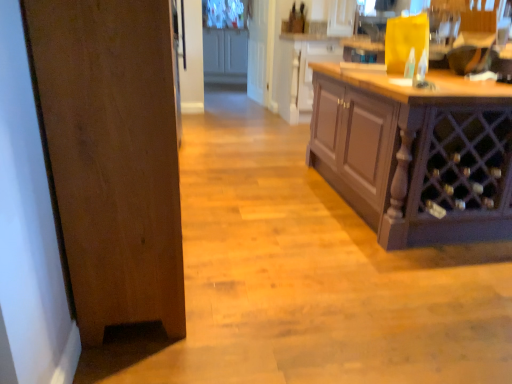
Where is `white glossy door at upper center`? This screenshot has height=384, width=512. white glossy door at upper center is located at coordinates pyautogui.click(x=260, y=50).

Image resolution: width=512 pixels, height=384 pixels. What do you see at coordinates (260, 50) in the screenshot? I see `white glossy door at upper center` at bounding box center [260, 50].

What do you see at coordinates (113, 156) in the screenshot? This screenshot has width=512, height=384. I see `wooden door at left` at bounding box center [113, 156].

Find the location of a particular element. wooden door at left is located at coordinates (113, 156).

The image size is (512, 384). Identify the location of matte gray cabinets at upper center, which is the 1th cabinetry in top-to-bottom order. (225, 56).

What do you see at coordinates (416, 154) in the screenshot? The width and height of the screenshot is (512, 384). I see `brown wood cabinet at right, which is the 3th cabinetry in top-to-bottom order` at bounding box center [416, 154].

Where is `white glossy door at upper center`? This screenshot has width=512, height=384. white glossy door at upper center is located at coordinates point(260,50).

Considering the relative positions of matte gray cabinets at upper center, placed as the 1th cabinetry when sorted from back to front, and matte wood cabinet at center, arranged as the 2th cabinetry when viewed from the left, in the image provided, is matte gray cabinets at upper center, placed as the 1th cabinetry when sorted from back to front, to the left or to the right of matte wood cabinet at center, arranged as the 2th cabinetry when viewed from the left,?

Clearly, matte gray cabinets at upper center, placed as the 1th cabinetry when sorted from back to front, is on the left of matte wood cabinet at center, arranged as the 2th cabinetry when viewed from the left, in the image.

From a real-world perspective, who is located lower, matte gray cabinets at upper center, the 3th cabinetry when ordered from right to left, or matte wood cabinet at center, which appears as the second cabinetry when viewed from the right?

In real-world perspective, matte wood cabinet at center, which appears as the second cabinetry when viewed from the right, is lower.

Which is in front, point (228, 48) or point (297, 62)?

The point (297, 62) is closer to the camera.

How much distance is there between matte gray cabinets at upper center, which is the 1th cabinetry in top-to-bottom order, and matte wood cabinet at center, which appears as the second cabinetry when viewed from the right?

A distance of 1.70 meters exists between matte gray cabinets at upper center, which is the 1th cabinetry in top-to-bottom order, and matte wood cabinet at center, which appears as the second cabinetry when viewed from the right.

How many degrees apart are the facing directions of matte wood cabinet at center, marked as the 2th cabinetry in a bottom-to-top arrangement, and brown wood cabinet at right, which ranks as the first cabinetry in front-to-back order?

The facing directions of matte wood cabinet at center, marked as the 2th cabinetry in a bottom-to-top arrangement, and brown wood cabinet at right, which ranks as the first cabinetry in front-to-back order, are 179 degrees apart.

From the image's perspective, is matte wood cabinet at center, the second cabinetry viewed from the top, beneath brown wood cabinet at right, which ranks as the first cabinetry in bottom-to-top order?

Incorrect, from the image's perspective, matte wood cabinet at center, the second cabinetry viewed from the top, is higher than brown wood cabinet at right, which ranks as the first cabinetry in bottom-to-top order.

Would you say matte wood cabinet at center, marked as the 2th cabinetry in a bottom-to-top arrangement, is inside or outside brown wood cabinet at right, which is the 3th cabinetry in top-to-bottom order?

matte wood cabinet at center, marked as the 2th cabinetry in a bottom-to-top arrangement, is located beyond the bounds of brown wood cabinet at right, which is the 3th cabinetry in top-to-bottom order.

From a real-world perspective, is matte wood cabinet at center, arranged as the 2th cabinetry when viewed from the left, located beneath brown wood cabinet at right, which ranks as the first cabinetry in bottom-to-top order?

Indeed, from a real-world perspective, matte wood cabinet at center, arranged as the 2th cabinetry when viewed from the left, is positioned beneath brown wood cabinet at right, which ranks as the first cabinetry in bottom-to-top order.

Is white glossy door at upper center aimed at brown wood cabinet at right, the third cabinetry in the left-to-right sequence?

No, white glossy door at upper center is not turned towards brown wood cabinet at right, the third cabinetry in the left-to-right sequence.

Does white glossy door at upper center lie behind brown wood cabinet at right, which ranks as the first cabinetry in front-to-back order?

Yes, the depth of white glossy door at upper center is greater than that of brown wood cabinet at right, which ranks as the first cabinetry in front-to-back order.

Could brown wood cabinet at right, which ranks as the third cabinetry in back-to-front order, be considered to be inside white glossy door at upper center?

No, brown wood cabinet at right, which ranks as the third cabinetry in back-to-front order, is located outside of white glossy door at upper center.

Starting from the white glossy door at upper center, which cabinetry is the 2nd one in front? Please provide its 2D coordinates.

[(416, 154)]

Is brown wood cabinet at right, which ranks as the first cabinetry in bottom-to-top order, further to camera compared to wooden door at left?

Yes, brown wood cabinet at right, which ranks as the first cabinetry in bottom-to-top order, is further from the camera.

From the image's perspective, between brown wood cabinet at right, which ranks as the third cabinetry in back-to-front order, and wooden door at left, who is located below?

wooden door at left.

In the image, there is a brown wood cabinet at right, which ranks as the first cabinetry in bottom-to-top order. At what (x,y) coordinates should I click in order to perform the action: click on door below it (from the image's perspective). Please return your answer as a coordinate pair (x, y). The image size is (512, 384). Looking at the image, I should click on (113, 156).

From the picture: Considering the sizes of objects brown wood cabinet at right, acting as the 1th cabinetry starting from the right, and wooden door at left in the image provided, who is wider, brown wood cabinet at right, acting as the 1th cabinetry starting from the right, or wooden door at left?

With larger width is brown wood cabinet at right, acting as the 1th cabinetry starting from the right.

Does wooden door at left have a greater width compared to brown wood cabinet at right, the third cabinetry in the left-to-right sequence?

No.

In the scene shown: Can you confirm if wooden door at left is shorter than brown wood cabinet at right, the third cabinetry in the left-to-right sequence?

In fact, wooden door at left may be taller than brown wood cabinet at right, the third cabinetry in the left-to-right sequence.

Considering the relative sizes of wooden door at left and brown wood cabinet at right, which is the 3th cabinetry in top-to-bottom order, in the image provided, is wooden door at left smaller than brown wood cabinet at right, which is the 3th cabinetry in top-to-bottom order,?

Correct, wooden door at left occupies less space than brown wood cabinet at right, which is the 3th cabinetry in top-to-bottom order.

Which of these two, wooden door at left or matte gray cabinets at upper center, which is the 3th cabinetry from front to back, is smaller?

matte gray cabinets at upper center, which is the 3th cabinetry from front to back, is smaller.

Locate an element on the screen. cabinetry on the left of wooden door at left is located at coordinates (225, 56).

Is wooden door at left positioned beyond the bounds of matte gray cabinets at upper center, which is the 1th cabinetry in top-to-bottom order?

wooden door at left is positioned outside matte gray cabinets at upper center, which is the 1th cabinetry in top-to-bottom order.

Between point (152, 249) and point (207, 37), which one is positioned in front?

The point (152, 249) is in front.

Does white glossy door at upper center have a larger size compared to wooden door at left?

Actually, white glossy door at upper center might be smaller than wooden door at left.

Is white glossy door at upper center wider than wooden door at left?

In fact, white glossy door at upper center might be narrower than wooden door at left.

Considering the points (269, 100) and (77, 258), which point is in front, point (269, 100) or point (77, 258)?

The point (77, 258) is more forward.

You are a GUI agent. You are given a task and a screenshot of the screen. Output one action in this format:
    pyautogui.click(x=<x>, y=<y>)
    Task: Click on the cabinetry behind the matte wood cabinet at center, which appears as the second cabinetry when viewed from the right
    
    Given the screenshot: What is the action you would take?
    pyautogui.click(x=225, y=56)

Where is `cabinetry that is on the right side of matte wood cabinet at center, marked as the 2th cabinetry in a bottom-to-top arrangement`? cabinetry that is on the right side of matte wood cabinet at center, marked as the 2th cabinetry in a bottom-to-top arrangement is located at coordinates (416, 154).

Considering their positions, is matte wood cabinet at center, the second cabinetry viewed from the top, positioned further to white glossy door at upper center than matte gray cabinets at upper center, marked as the 1th cabinetry in a left-to-right arrangement?

Among the two, matte wood cabinet at center, the second cabinetry viewed from the top, is located further to white glossy door at upper center.

Estimate the real-world distances between objects in this image. Which object is closer to wooden door at left, brown wood cabinet at right, which ranks as the third cabinetry in back-to-front order, or matte gray cabinets at upper center, placed as the 1th cabinetry when sorted from back to front?

brown wood cabinet at right, which ranks as the third cabinetry in back-to-front order, lies closer to wooden door at left than the other object.

Estimate the real-world distances between objects in this image. Which object is further from matte gray cabinets at upper center, the 3th cabinetry when ordered from right to left, wooden door at left or brown wood cabinet at right, which ranks as the third cabinetry in back-to-front order?

wooden door at left is further to matte gray cabinets at upper center, the 3th cabinetry when ordered from right to left.

Looking at the image, which one is located further to matte wood cabinet at center, arranged as the 2th cabinetry when viewed from the left, matte gray cabinets at upper center, which is the third cabinetry in bottom-to-top order, or brown wood cabinet at right, acting as the 1th cabinetry starting from the right?

Based on the image, brown wood cabinet at right, acting as the 1th cabinetry starting from the right, appears to be further to matte wood cabinet at center, arranged as the 2th cabinetry when viewed from the left.

Which object lies nearer to the anchor point matte wood cabinet at center, which is the 2th cabinetry from back to front, wooden door at left or matte gray cabinets at upper center, which is the 3th cabinetry from front to back?

Among the two, matte gray cabinets at upper center, which is the 3th cabinetry from front to back, is located nearer to matte wood cabinet at center, which is the 2th cabinetry from back to front.

Which object lies further to the anchor point matte gray cabinets at upper center, the 3th cabinetry when ordered from right to left, brown wood cabinet at right, which ranks as the first cabinetry in front-to-back order, or matte wood cabinet at center, arranged as the 2th cabinetry when viewed from the front?

brown wood cabinet at right, which ranks as the first cabinetry in front-to-back order, is positioned further to the anchor matte gray cabinets at upper center, the 3th cabinetry when ordered from right to left.

Estimate the real-world distances between objects in this image. Which object is further from white glossy door at upper center, matte gray cabinets at upper center, marked as the 1th cabinetry in a left-to-right arrangement, or matte wood cabinet at center, which appears as the second cabinetry when viewed from the right?

matte wood cabinet at center, which appears as the second cabinetry when viewed from the right, is positioned further to the anchor white glossy door at upper center.

Looking at the image, which one is located closer to matte gray cabinets at upper center, marked as the 1th cabinetry in a left-to-right arrangement, wooden door at left or matte wood cabinet at center, marked as the 2th cabinetry in a bottom-to-top arrangement?

matte wood cabinet at center, marked as the 2th cabinetry in a bottom-to-top arrangement, lies closer to matte gray cabinets at upper center, marked as the 1th cabinetry in a left-to-right arrangement, than the other object.

Locate an element on the screen. The width and height of the screenshot is (512, 384). glass door between brown wood cabinet at right, acting as the 1th cabinetry starting from the right, and matte gray cabinets at upper center, the 3th cabinetry when ordered from right to left, along the z-axis is located at coordinates (260, 50).

Find the location of a particular element. This screenshot has width=512, height=384. cabinetry positioned between wooden door at left and matte wood cabinet at center, arranged as the 2th cabinetry when viewed from the left, from near to far is located at coordinates (416, 154).

Find the location of a particular element. glass door located between matte wood cabinet at center, which is the 2th cabinetry from back to front, and matte gray cabinets at upper center, the 3th cabinetry when ordered from right to left, in the depth direction is located at coordinates (260, 50).

I want to click on cabinetry between brown wood cabinet at right, which ranks as the first cabinetry in front-to-back order, and matte gray cabinets at upper center, which is the 3th cabinetry from front to back, from front to back, so click(x=301, y=71).